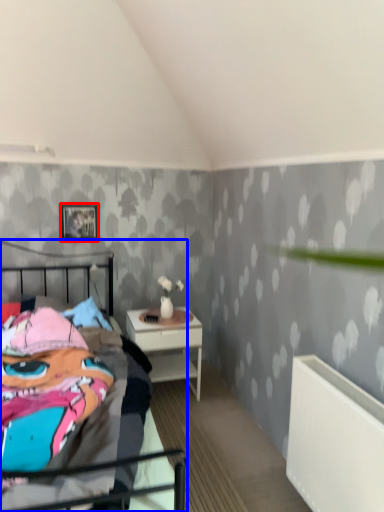
Question: Among these objects, which one is farthest to the camera, picture frame (highlighted by a red box) or bed (highlighted by a blue box)?

Choices:
 (A) picture frame
 (B) bed

Answer: (A)